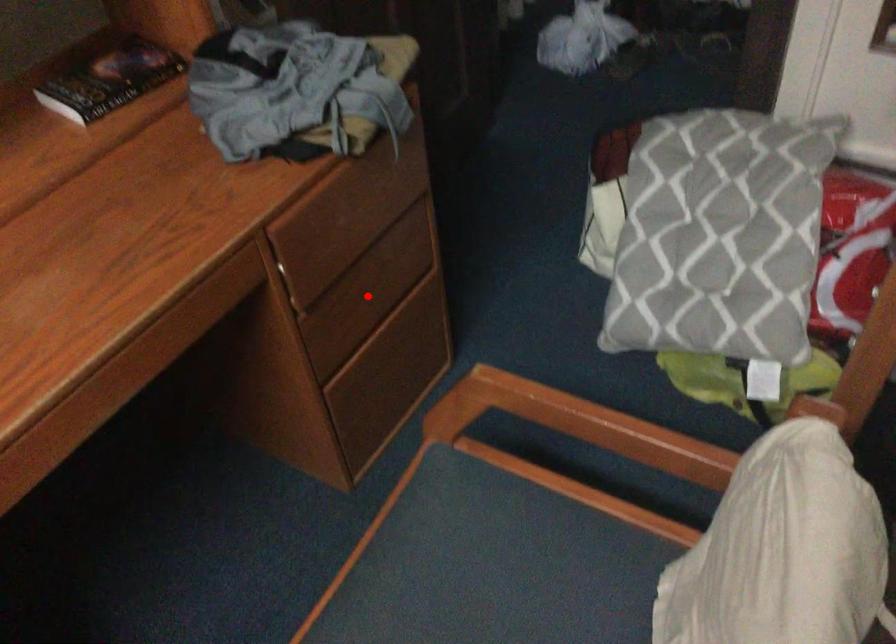
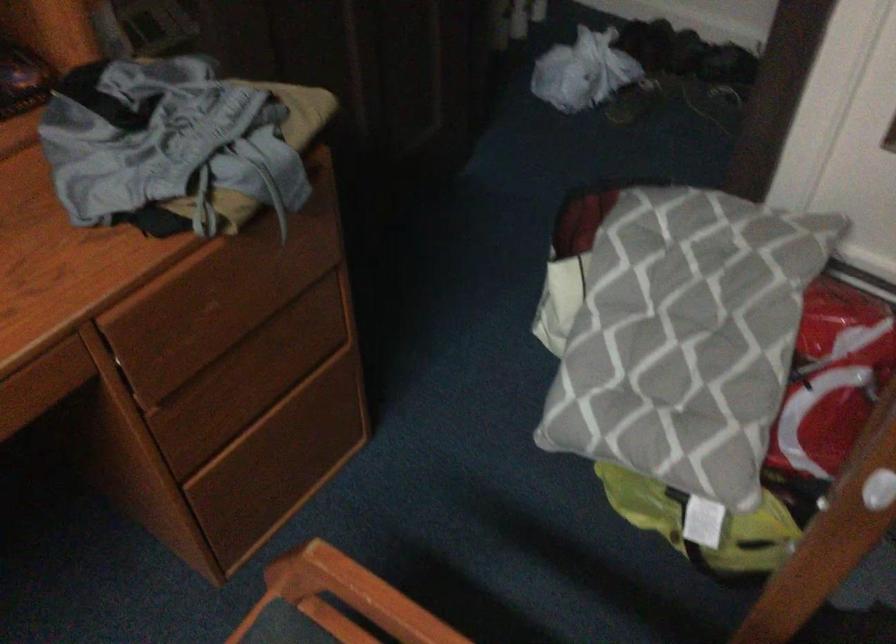
Question: I am providing you with two images of the same scene from different viewpoints. Image1 has a red point marked. In image2, the corresponding 3D location appears at what relative position? Reply with the corresponding letter.

Choices:
 (A) Closer
 (B) Farther

Answer: (A)